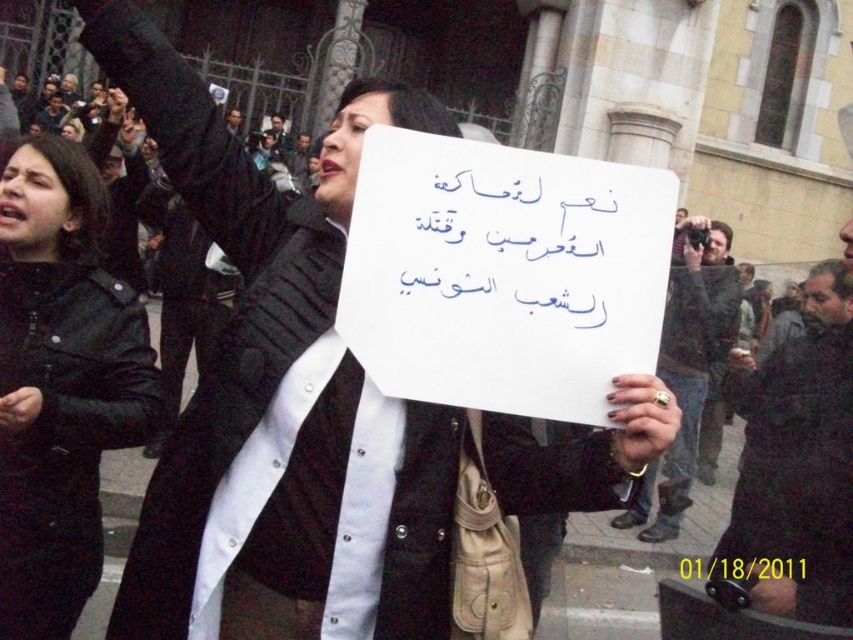
Question: Can you confirm if black leather jacket at left is wider than black leather robe at center?

Choices:
 (A) no
 (B) yes

Answer: (A)

Question: Which point is farther to the camera?

Choices:
 (A) black matte coat at center
 (B) black leather jacket at left
 (C) black matte robe at lower right
 (D) black leather robe at center

Answer: (C)

Question: Which object is closer to the camera taking this photo?

Choices:
 (A) black leather jacket at left
 (B) black matte robe at lower right
 (C) black leather robe at center

Answer: (C)

Question: Is black leather jacket at left below black leather robe at center?

Choices:
 (A) yes
 (B) no

Answer: (B)

Question: Is black matte coat at center wider than black leather jacket at left?

Choices:
 (A) yes
 (B) no

Answer: (A)

Question: Among these points, which one is farthest from the camera?

Choices:
 (A) (39, 156)
 (B) (705, 385)
 (C) (824, 509)

Answer: (B)